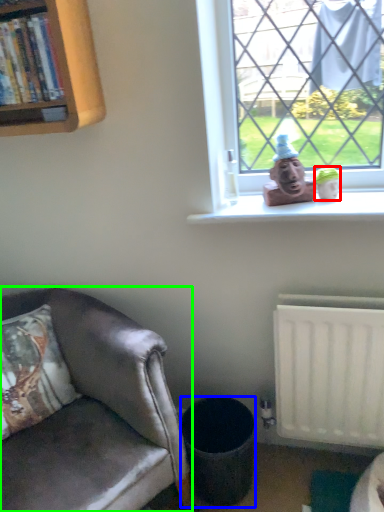
Question: Considering the real-world distances, which object is closest to toy (highlighted by a red box)? trash bin/can (highlighted by a blue box) or chair (highlighted by a green box).

Choices:
 (A) trash bin/can
 (B) chair

Answer: (A)